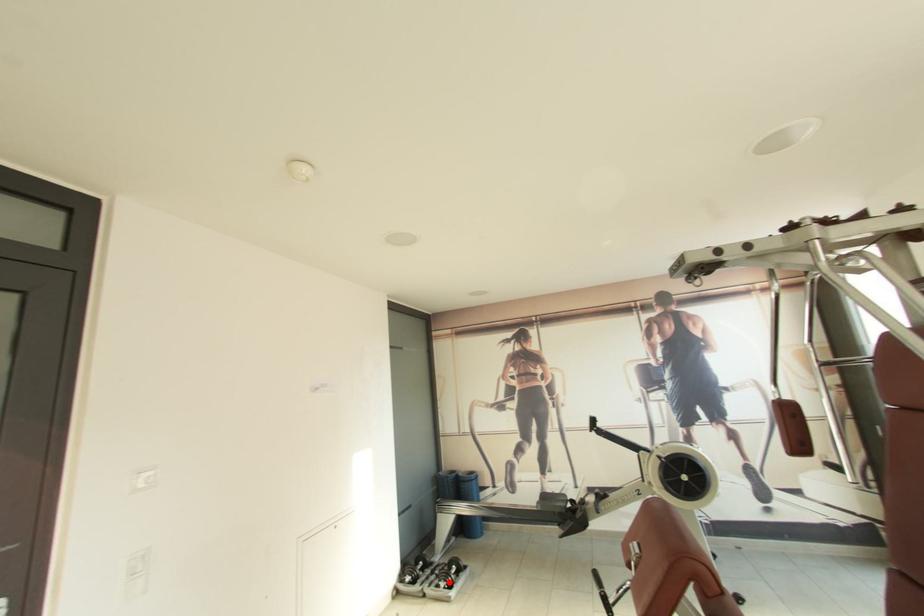
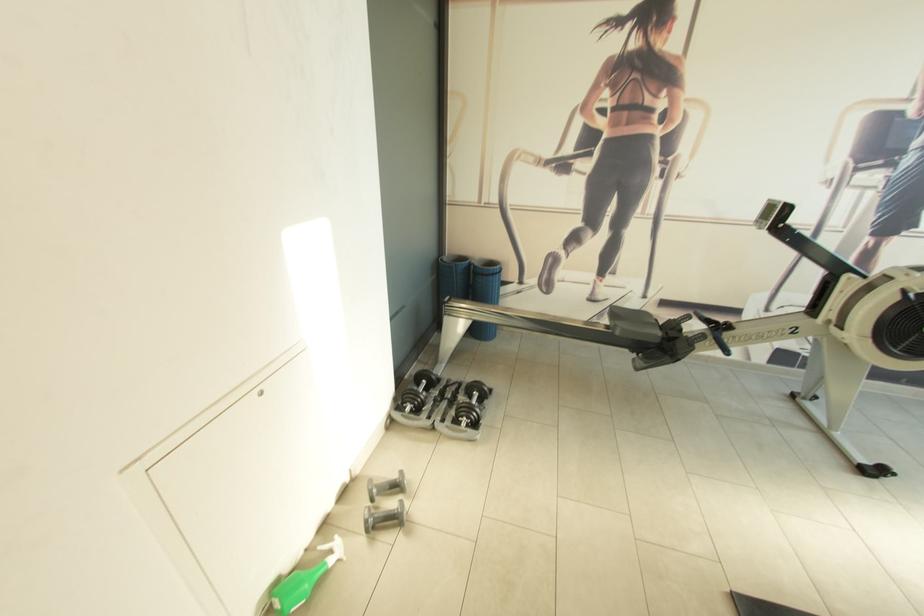
Question: I am providing you with two images of the same scene from different viewpoints. In image1, a red point is highlighted. Considering the same 3D point in image2, which of the following is correct?

Choices:
 (A) It is closer
 (B) It is farther

Answer: (A)